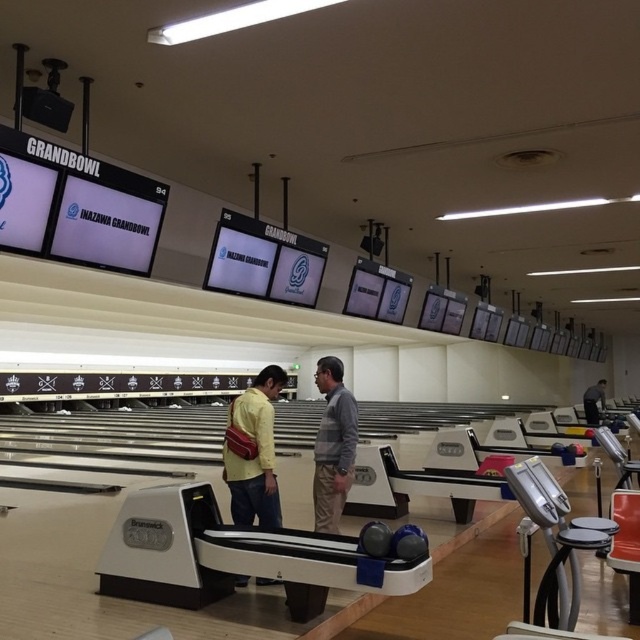
You are a GUI agent. You are given a task and a screenshot of the screen. Output one action in this format:
    pyautogui.click(x=<x>, y=<y>)
    Task: Click on the yellow matte shirt at center
    The width and height of the screenshot is (640, 640).
    Given the screenshot: What is the action you would take?
    pyautogui.click(x=253, y=452)

Between yellow matte shirt at center and light brown leather jacket at center, which one is positioned lower?

light brown leather jacket at center is lower down.

Between point (257, 440) and point (595, 397), which one is positioned in front?

Point (257, 440) is more forward.

At what (x,y) coordinates should I click in order to perform the action: click on yellow matte shirt at center. Please return your answer as a coordinate pair (x, y). Image resolution: width=640 pixels, height=640 pixels. Looking at the image, I should click on (253, 452).

Can you confirm if gray sweater at center is positioned above light brown leather jacket at center?

Correct, gray sweater at center is located above light brown leather jacket at center.

Does point (292, 588) come in front of point (588, 419)?

Yes, point (292, 588) is in front of point (588, 419).

Identify the location of gray sweater at center. This screenshot has width=640, height=640. (332, 445).

Does yellow matte shirt at center have a lesser height compared to gray sweater at center?

In fact, yellow matte shirt at center may be taller than gray sweater at center.

Does yellow matte shirt at center have a larger size compared to gray sweater at center?

Indeed, yellow matte shirt at center has a larger size compared to gray sweater at center.

Does point (244, 400) come behind point (305, 589)?

Yes, it is behind point (305, 589).

Locate an element on the screen. Image resolution: width=640 pixels, height=640 pixels. yellow matte shirt at center is located at coordinates (253, 452).